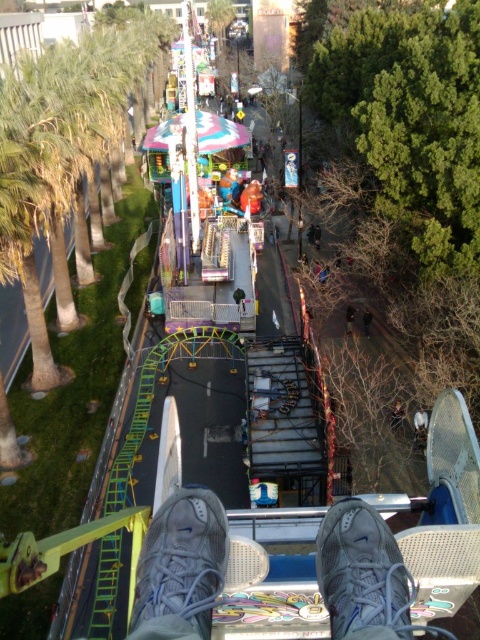
What do you see at coordinates (180, 566) in the screenshot? I see `gray fabric shoe at lower center` at bounding box center [180, 566].

Does gray fabric shoe at lower center have a greater width compared to dark brown leather jacket at center?

Indeed, gray fabric shoe at lower center has a greater width compared to dark brown leather jacket at center.

Image resolution: width=480 pixels, height=640 pixels. What do you see at coordinates (180, 566) in the screenshot?
I see `gray fabric shoe at lower center` at bounding box center [180, 566].

This screenshot has height=640, width=480. I want to click on gray fabric shoe at lower center, so click(180, 566).

The image size is (480, 640). What do you see at coordinates (361, 573) in the screenshot?
I see `white mesh shoe at lower center` at bounding box center [361, 573].

Which is behind, point (385, 582) or point (351, 305)?

The point (351, 305) is more distant.

This screenshot has height=640, width=480. I want to click on white mesh shoe at lower center, so click(x=361, y=573).

Is point (349, 310) more distant than point (372, 317)?

That is False.

Is dark blue jeans at center positioned in front of dark brown leather jacket at center?

No, dark blue jeans at center is further to the viewer.

Between point (350, 324) and point (369, 321), which one is positioned behind?

Point (350, 324)

Find the location of a particular element. The image size is (480, 640). dark blue jeans at center is located at coordinates (349, 317).